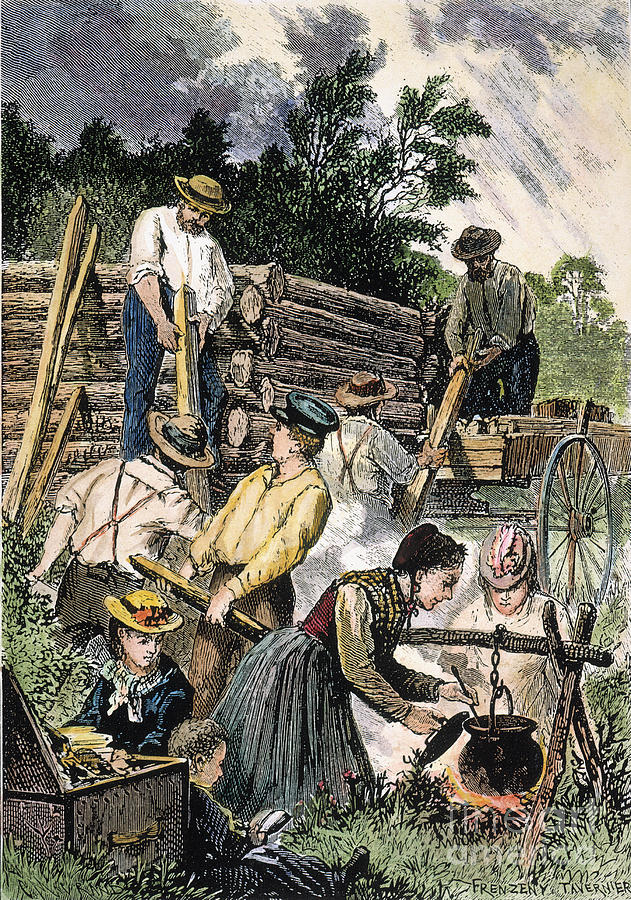
Identify the location of painting. (397, 428).